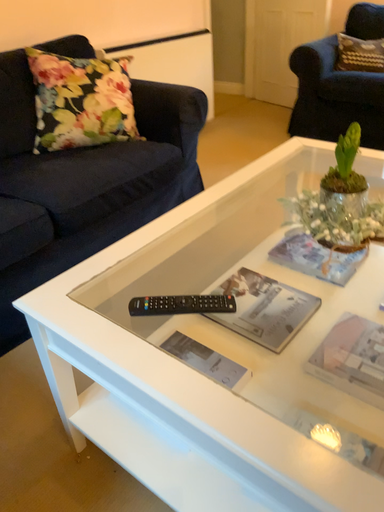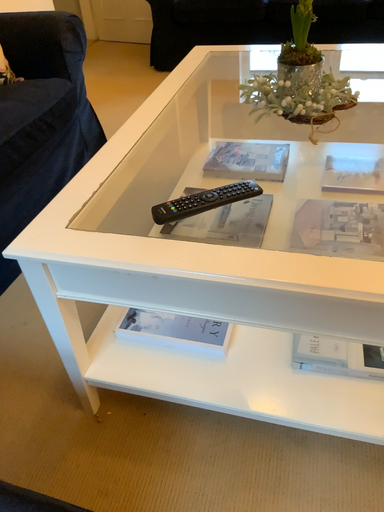
Question: How did the camera likely rotate when shooting the video?

Choices:
 (A) rotated right
 (B) rotated left

Answer: (A)